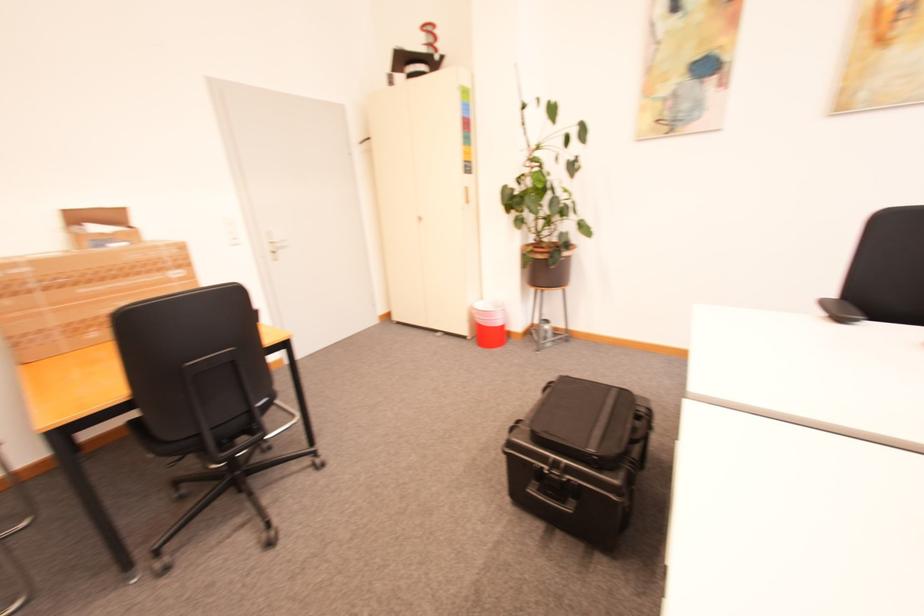
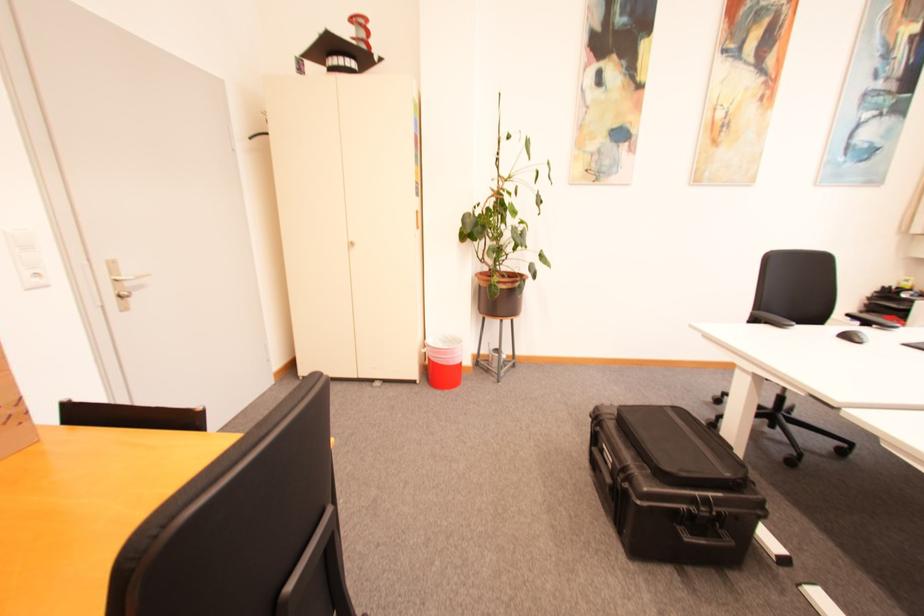
The point at (x=575, y=509) is marked in the first image. Where is the corresponding point in the second image?

(736, 541)